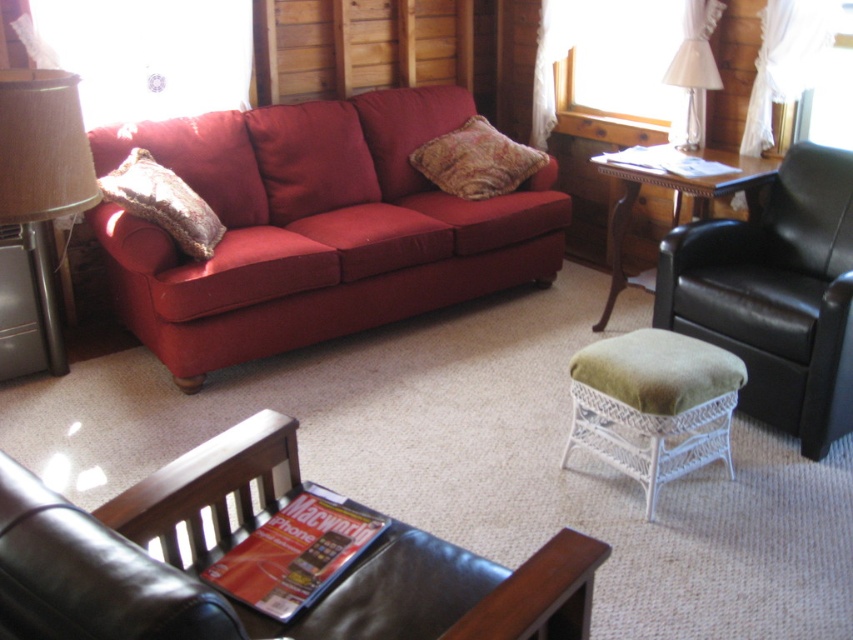
Which is below, wooden table at center right or suede-like brown pillow at left?

wooden table at center right is lower down.

You are a GUI agent. You are given a task and a screenshot of the screen. Output one action in this format:
    pyautogui.click(x=<x>, y=<y>)
    Task: Click on the wooden table at center right
    Image resolution: width=853 pixels, height=640 pixels.
    Given the screenshot: What is the action you would take?
    pyautogui.click(x=676, y=196)

Who is positioned more to the left, orange glossy magazine at lower center or suede-like brown pillow at left?

From the viewer's perspective, suede-like brown pillow at left appears more on the left side.

Between point (300, 492) and point (106, 186), which one is positioned behind?

The point (106, 186) is more distant.

Find the location of a particular element. Image resolution: width=853 pixels, height=640 pixels. orange glossy magazine at lower center is located at coordinates (294, 554).

In the scene shown: Is brown leather armchair at lower left bigger than white wicker stool at center?

Correct, brown leather armchair at lower left is larger in size than white wicker stool at center.

In the scene shown: Measure the distance from brown leather armchair at lower left to white wicker stool at center.

brown leather armchair at lower left is 3.54 feet from white wicker stool at center.

Does point (602, 547) come behind point (709, 420)?

No.

What are the coordinates of `brown leather armchair at lower left` in the screenshot? It's located at (239, 541).